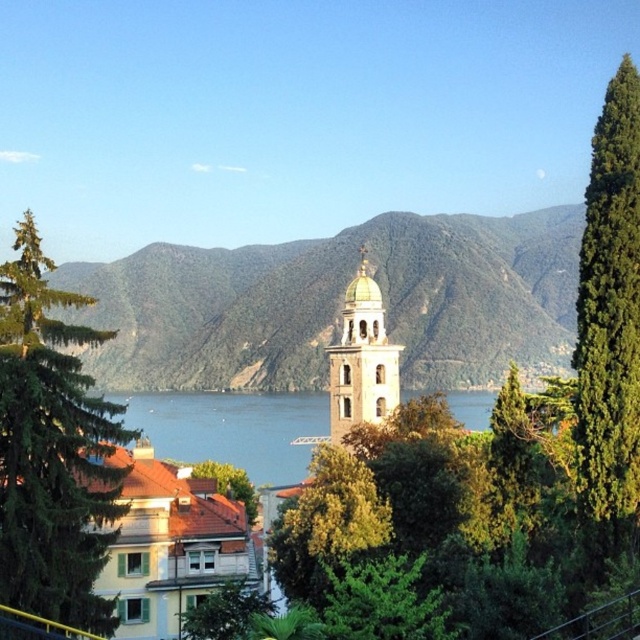
Question: Is green textured tree at right to the right of green leafy tree at lower center from the viewer's perspective?

Choices:
 (A) yes
 (B) no

Answer: (A)

Question: Is green leafy tree at center to the right of green leafy tree at lower center from the viewer's perspective?

Choices:
 (A) yes
 (B) no

Answer: (A)

Question: Among these objects, which one is farthest from the camera?

Choices:
 (A) green leafy tree at center
 (B) gold domed bell tower at center

Answer: (B)

Question: Is green textured tree at left thinner than green leafy tree at lower center?

Choices:
 (A) yes
 (B) no

Answer: (A)

Question: Among these points, which one is farthest from the camera?

Choices:
 (A) (6, 301)
 (B) (230, 492)
 (C) (372, 285)
 (D) (604, 364)

Answer: (C)

Question: Which of the following is the farthest from the observer?

Choices:
 (A) green leafy tree at lower center
 (B) green leafy tree at center

Answer: (A)